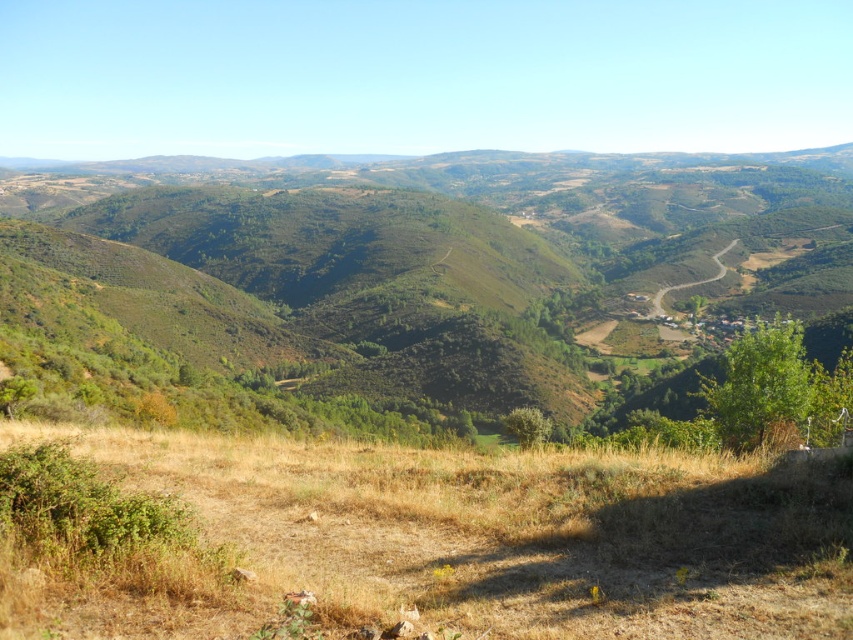
Question: Among these points, which one is farthest from the camera?

Choices:
 (A) (392, 236)
 (B) (746, 596)

Answer: (A)

Question: Among these objects, which one is nearest to the camera?

Choices:
 (A) dry grass at lower center
 (B) green leafy hillside at center

Answer: (A)

Question: Considering the relative positions of green leafy hillside at center and dry grass at lower center in the image provided, where is green leafy hillside at center located with respect to dry grass at lower center?

Choices:
 (A) above
 (B) below

Answer: (A)

Question: Which of the following is the farthest from the observer?

Choices:
 (A) green leafy hillside at center
 (B) dry grass at lower center

Answer: (A)

Question: Does green leafy hillside at center appear over dry grass at lower center?

Choices:
 (A) no
 (B) yes

Answer: (B)

Question: Does green leafy hillside at center come in front of dry grass at lower center?

Choices:
 (A) no
 (B) yes

Answer: (A)